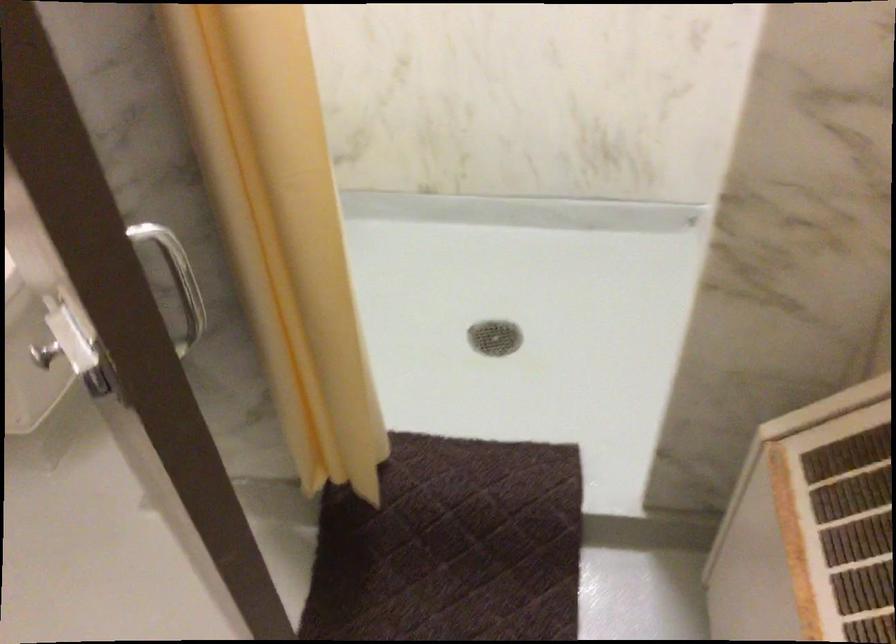
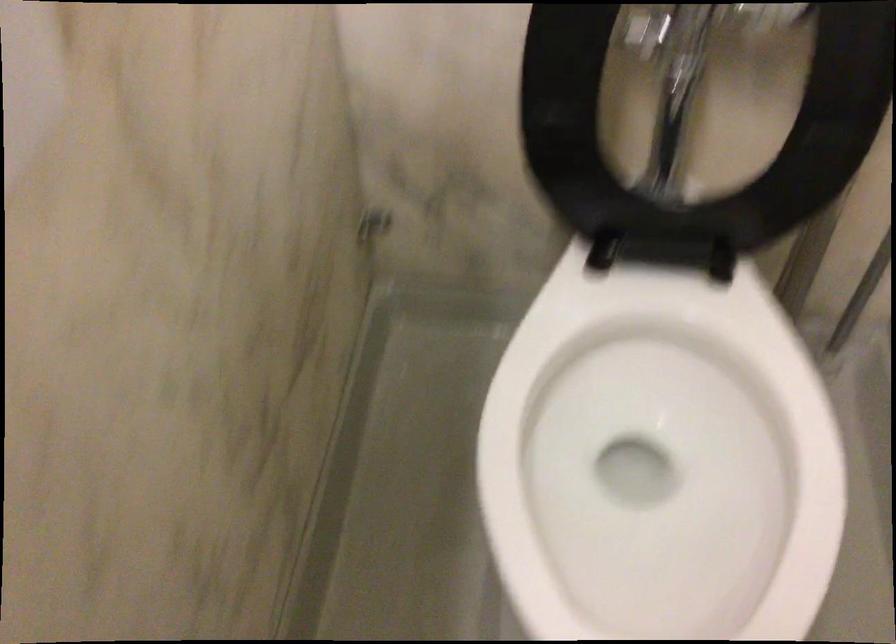
In the scene shown: Which direction would the cameraman need to move to produce the second image?

The movement direction of the cameraman is left, forward.